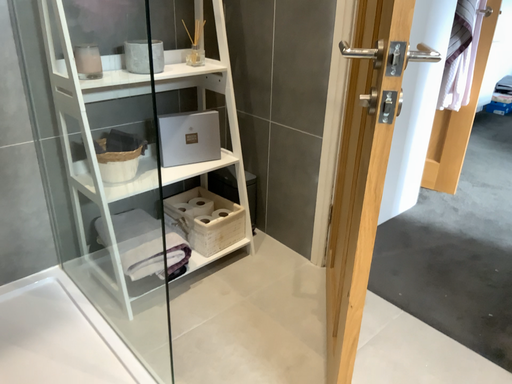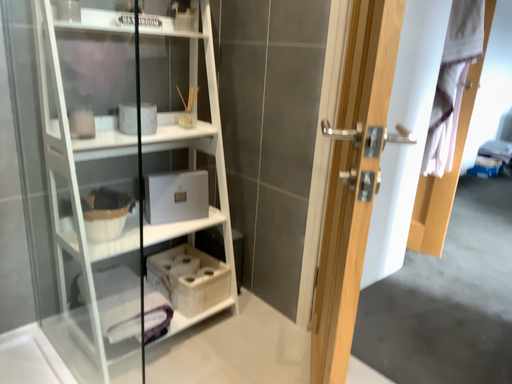
Question: Which way did the camera rotate in the video?

Choices:
 (A) rotated upward
 (B) rotated downward

Answer: (A)